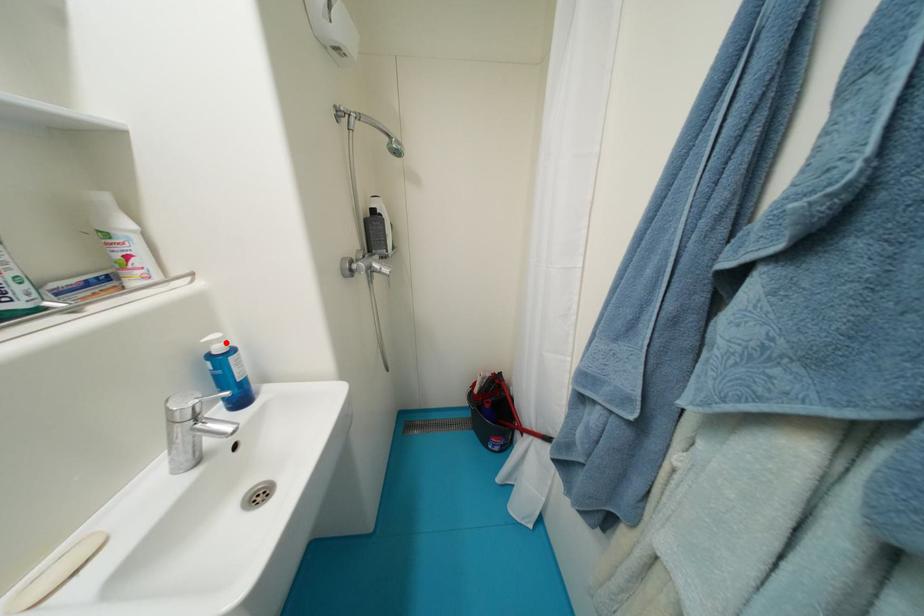
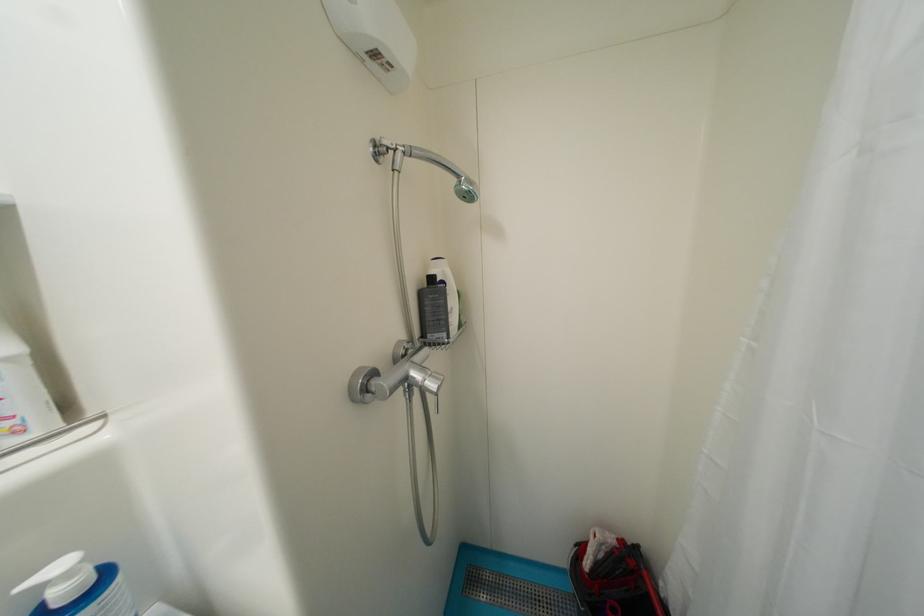
The point at the highlighted location is marked in the first image. Where is the corresponding point in the second image?

(75, 576)